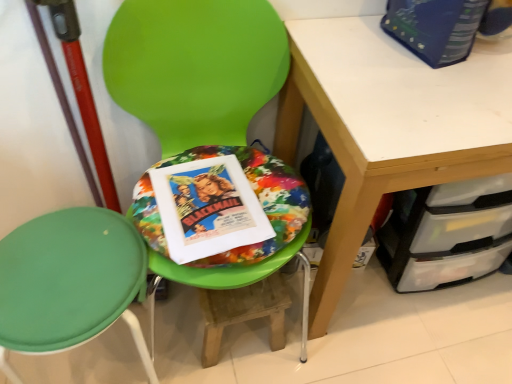
This screenshot has height=384, width=512. In order to click on vacant point above green fabric chair at center, the first chair viewed from the left (from a real-world perspective) in this screenshot , I will do `click(67, 269)`.